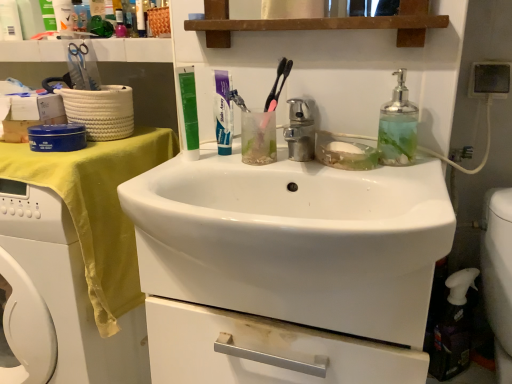
Question: From a real-world perspective, is white glossy sink at center physically located above or below green matte toothpaste tube at upper center?

Choices:
 (A) above
 (B) below

Answer: (B)

Question: Considering the relative positions of white glossy sink at center and green matte toothpaste tube at upper center in the image provided, is white glossy sink at center to the left or to the right of green matte toothpaste tube at upper center?

Choices:
 (A) right
 (B) left

Answer: (A)

Question: Based on their relative distances, which object is farther from the white plastic spray bottle at lower right?

Choices:
 (A) yellow fabric at left
 (B) polished chrome faucet at center
 (C) white glossy sink at center
 (D) green matte toothpaste tube at upper center
 (E) clear glass soap dispenser at right

Answer: (A)

Question: Which object is the farthest from the white glossy sink at center?

Choices:
 (A) yellow fabric at left
 (B) green matte toothpaste tube at upper center
 (C) white plastic spray bottle at lower right
 (D) polished chrome faucet at center
 (E) clear glass soap dispenser at right

Answer: (C)